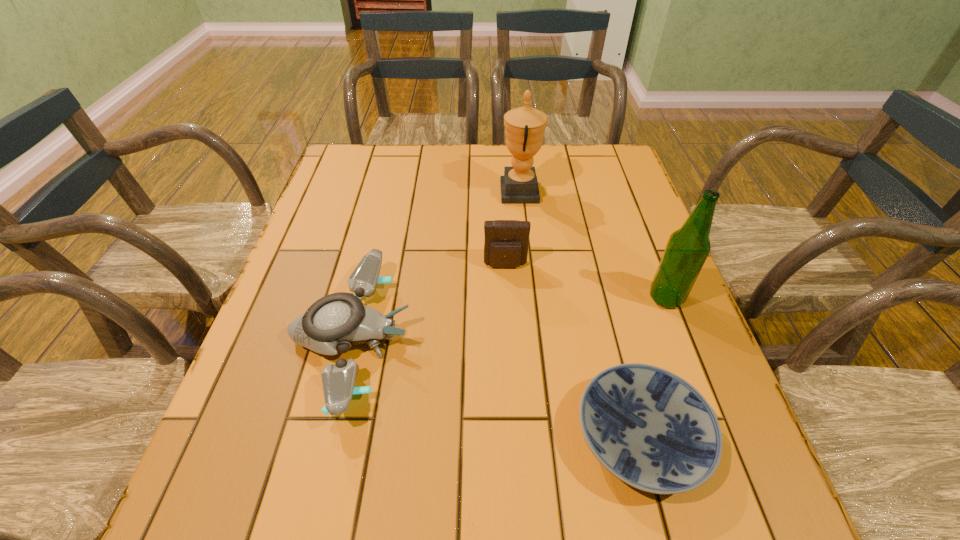
The height and width of the screenshot is (540, 960). Find the location of `vacant space that is in between the leftmost object and the beer bottle`. vacant space that is in between the leftmost object and the beer bottle is located at coordinates (509, 318).

Locate an element on the screen. This screenshot has height=540, width=960. free space between the plate and the farthest object is located at coordinates (580, 314).

I want to click on vacant area that lies between the plate and the third shortest object, so click(573, 351).

Where is `free spot between the plate and the award`? This screenshot has height=540, width=960. free spot between the plate and the award is located at coordinates (x=580, y=314).

Locate an element on the screen. This screenshot has width=960, height=540. vacant area between the farthest object and the plate is located at coordinates (580, 314).

You are a GUI agent. You are given a task and a screenshot of the screen. Output one action in this format:
    pyautogui.click(x=<x>, y=<y>)
    Task: Click on the free space between the second shortest object and the beer bottle
    Image resolution: width=960 pixels, height=540 pixels.
    Given the screenshot: What is the action you would take?
    pyautogui.click(x=509, y=318)

Where is `vacant space that's between the plate and the second shortest object`? This screenshot has width=960, height=540. vacant space that's between the plate and the second shortest object is located at coordinates (495, 387).

Find the location of `object that is the nearest to the farthest object`. object that is the nearest to the farthest object is located at coordinates (506, 243).

Choose which object is the second nearest neighbor to the beer bottle. Please provide its 2D coordinates. Your answer should be formatted as a tuple, i.e. [(x, y)], where the tuple contains the x and y coordinates of a point satisfying the conditions above.

[(506, 243)]

I want to click on vacant region that satisfies the following two spatial constraints: 1. on the label of the beer bottle; 2. on the front side of the shortest object, so click(x=720, y=436).